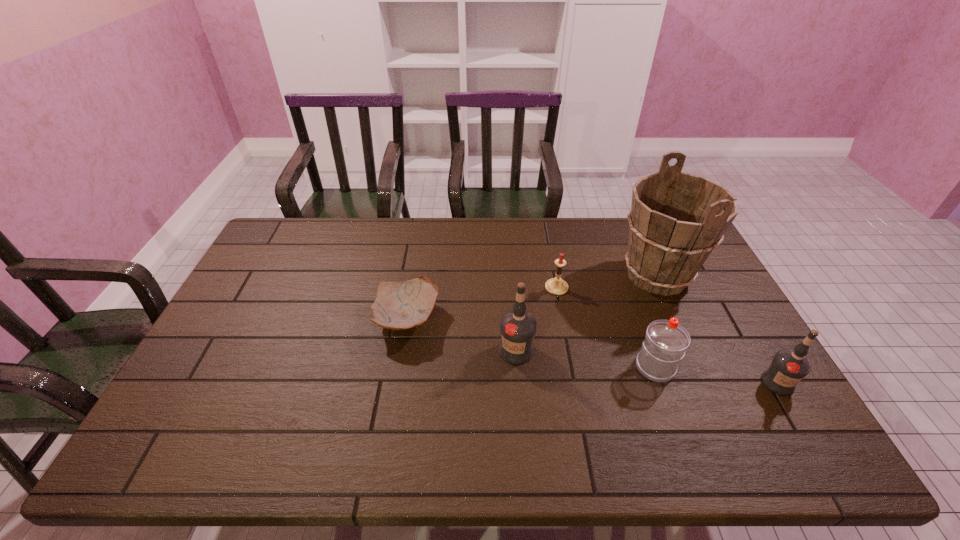
Where is `the second object from left to right`? The height and width of the screenshot is (540, 960). the second object from left to right is located at coordinates (517, 327).

This screenshot has width=960, height=540. Find the location of `the fifth shortest object`. the fifth shortest object is located at coordinates (517, 327).

Where is `the rightmost object`? the rightmost object is located at coordinates (788, 367).

Where is `the nearer vodka`? The image size is (960, 540). the nearer vodka is located at coordinates (788, 367).

At what (x,y) coordinates should I click in order to perform the action: click on bucket. Please return your answer as a coordinate pair (x, y). Image resolution: width=960 pixels, height=540 pixels. Looking at the image, I should click on (676, 220).

Find the location of a particular element. The image size is (960, 540). the leftmost object is located at coordinates (402, 305).

I want to click on pottery, so click(402, 305).

Identify the location of the second shortest object. The height and width of the screenshot is (540, 960). (556, 286).

At what (x,y) coordinates should I click in order to perform the action: click on the fourth object from right to left. Please return your answer as a coordinate pair (x, y). This screenshot has height=540, width=960. Looking at the image, I should click on (556, 286).

Find the location of a particular element. The image size is (960, 540). water bottle is located at coordinates pyautogui.click(x=666, y=341).